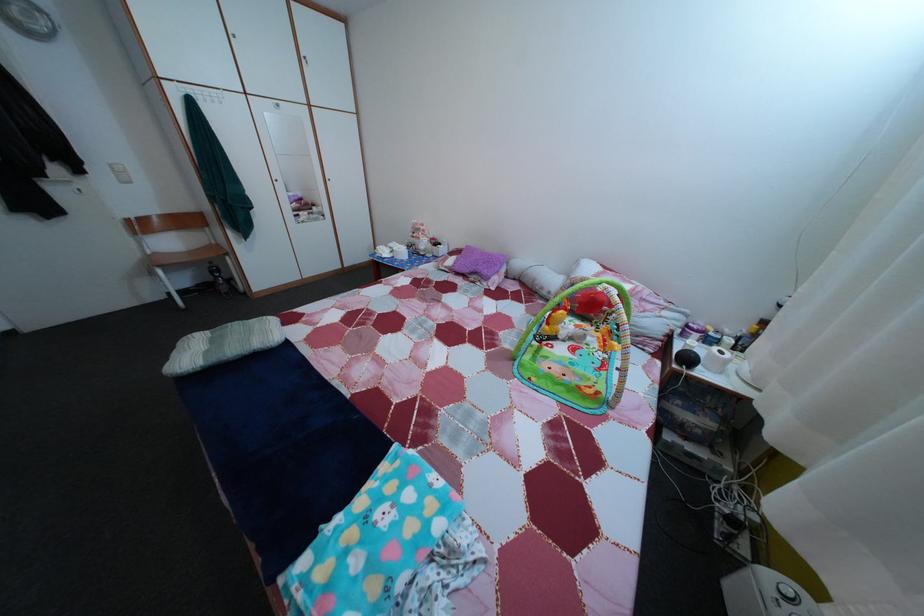
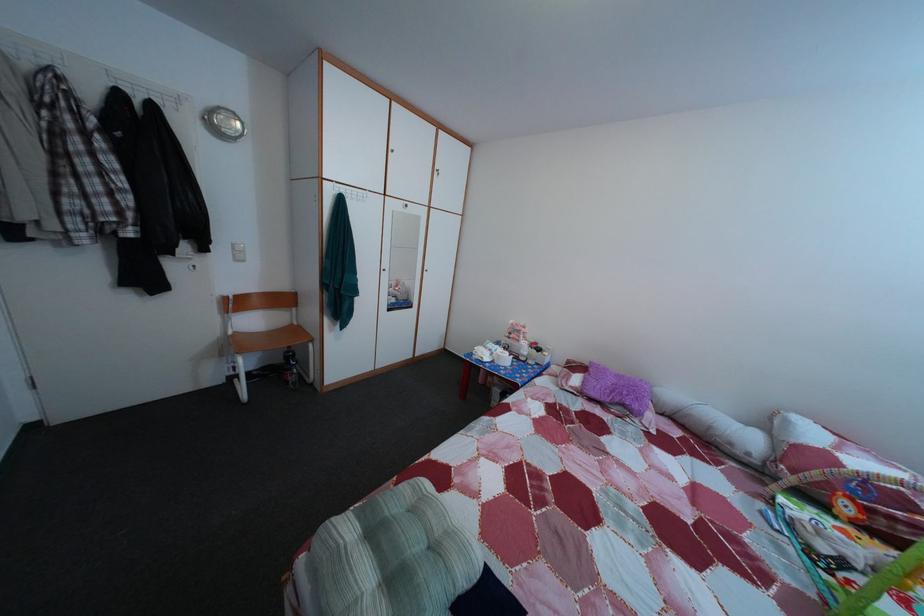
Question: What movement of the cameraman would produce the second image?

Choices:
 (A) Left
 (B) Right
 (C) Forward
 (D) Backward

Answer: (A)